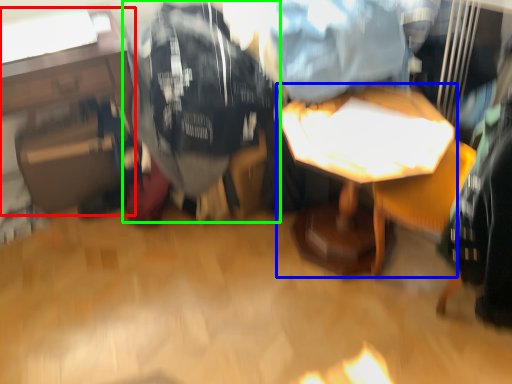
Question: Which is nearer to the table (highlighted by a red box)? table (highlighted by a blue box) or clothing (highlighted by a green box).

Choices:
 (A) table
 (B) clothing

Answer: (B)